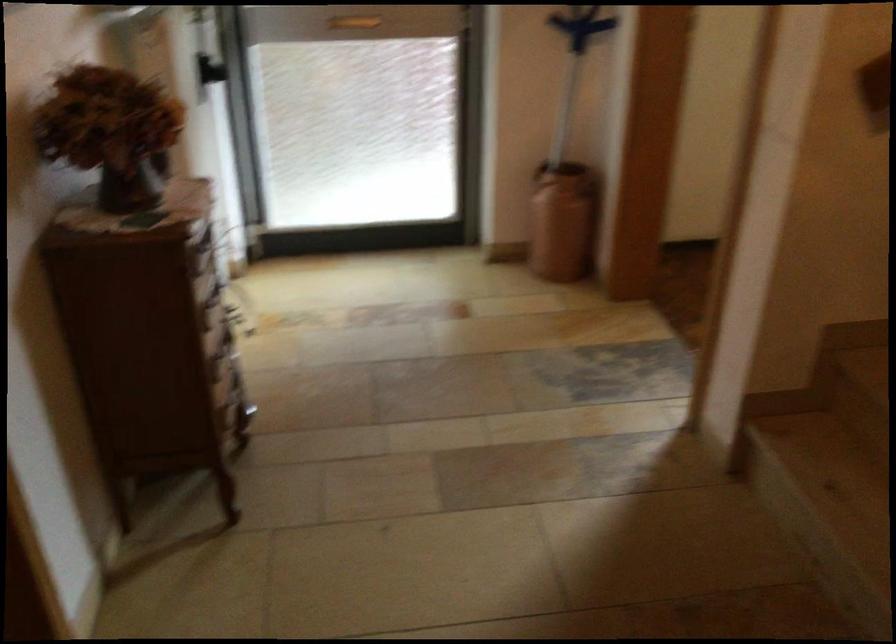
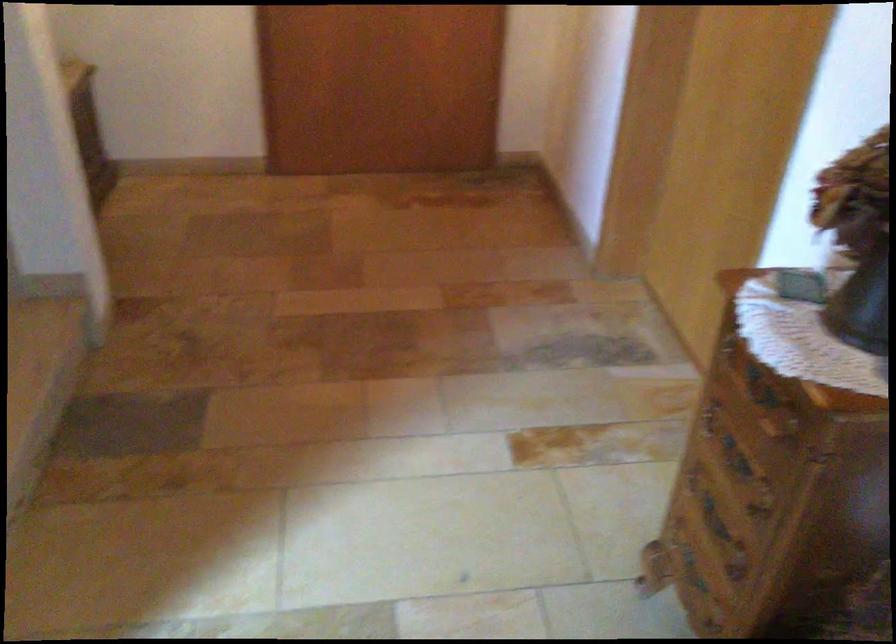
In the second image, find the point that corresponds to [194,286] in the first image.

(760, 386)